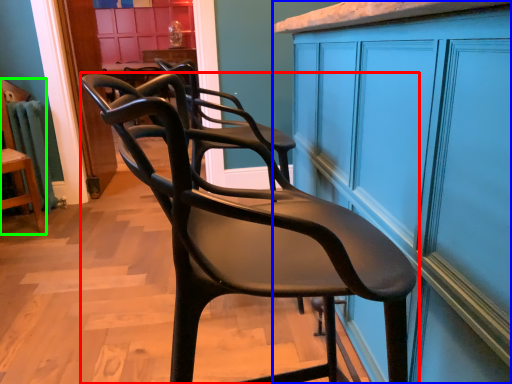
Question: Based on their relative distances, which object is farther from chair (highlighted by a red box)? Choose from cabinetry (highlighted by a blue box) and chair (highlighted by a green box).

Choices:
 (A) cabinetry
 (B) chair

Answer: (B)